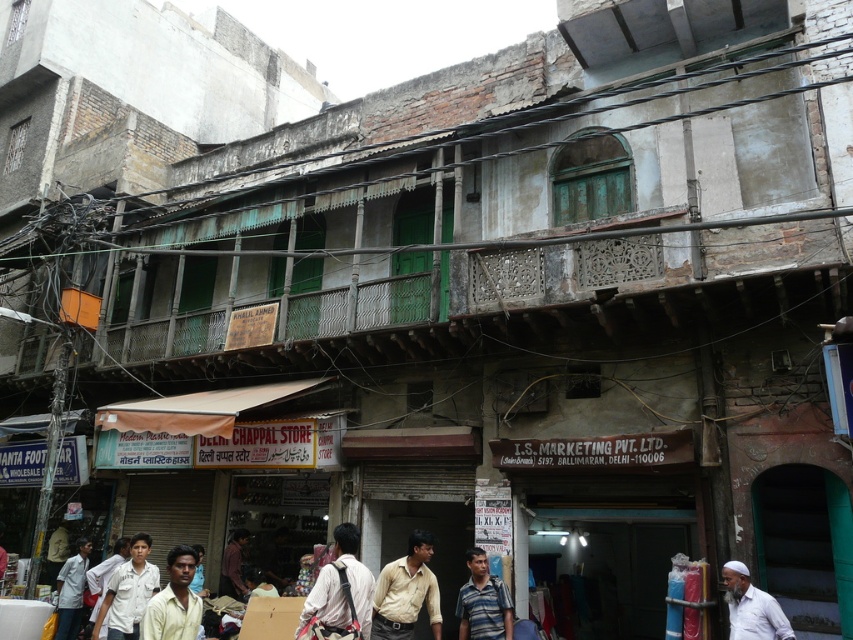
You are a customer looking for a striped cotton shirt at lower center to wear with your new sandals. You see a light brown shirt at center nearby. Which shirt is positioned to the right side in the store display?

The striped cotton shirt at lower center is positioned to the right side of the light brown shirt at center.